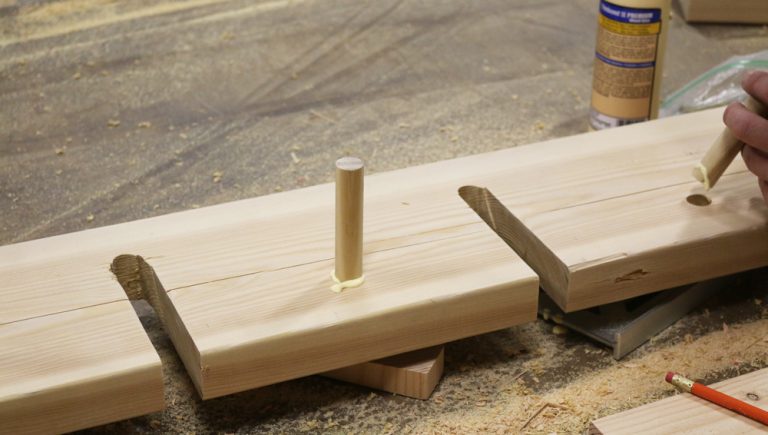
You are a GUI agent. You are given a task and a screenshot of the screen. Output one action in this format:
    pyautogui.click(x=<x>, y=<y>)
    Task: Click on the bottle
    
    Given the screenshot: What is the action you would take?
    pyautogui.click(x=624, y=94)